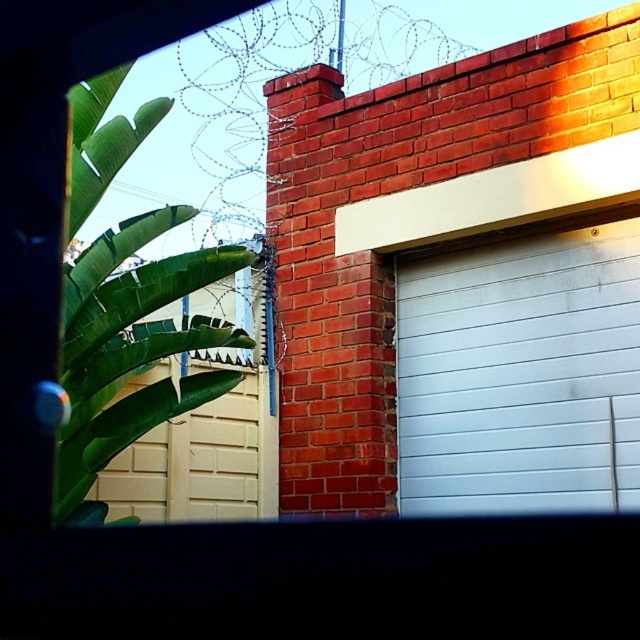
From the picture: You are a delivery robot with a package that measures 5 feet in length. You need to navigate through the space between the white smooth garage door at center and the beige textured garage door at lower left. Can your package fit through this space without bending or damaging it?

The distance between the white smooth garage door at center and the beige textured garage door at lower left is 4.58 feet. Since your package is 5 feet long, it is longer than the available space. Therefore, the package cannot fit through the space without bending or damaging it.

You are a gardener trying to assess the space between the green leafy plant at left and the beige textured garage door at lower left. Which object takes up more horizontal space in the image?

The beige textured garage door at lower left takes up more horizontal space because its width is greater than the green leafy plant at left.